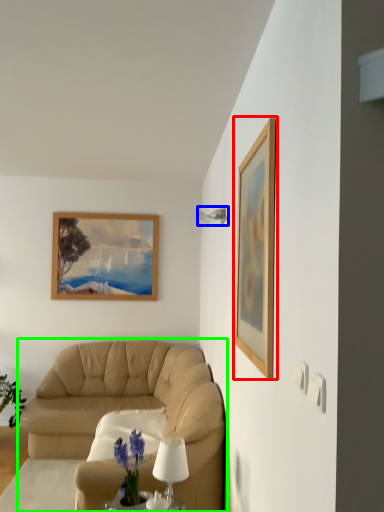
Question: Which object is the closest to the picture frame (highlighted by a red box)? Choose among these: lamp (highlighted by a blue box) or studio couch (highlighted by a green box).

Choices:
 (A) lamp
 (B) studio couch

Answer: (A)